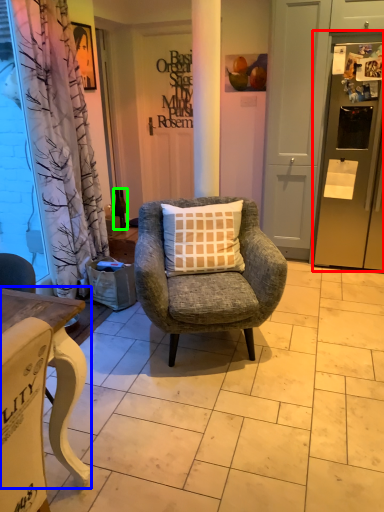
Question: Which is nearer to the refrigerator (highlighted by a red box)? desk (highlighted by a blue box) or bottle (highlighted by a green box).

Choices:
 (A) desk
 (B) bottle

Answer: (B)